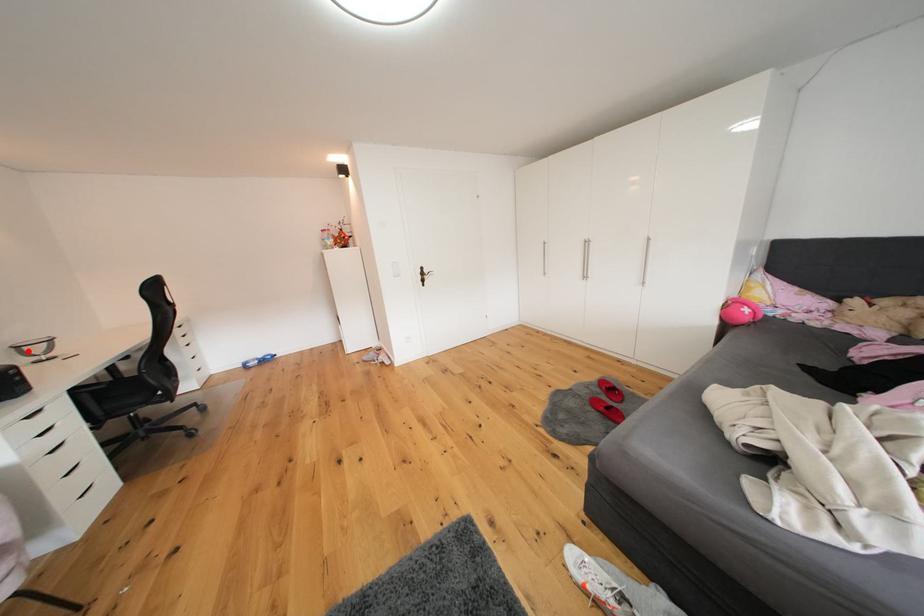
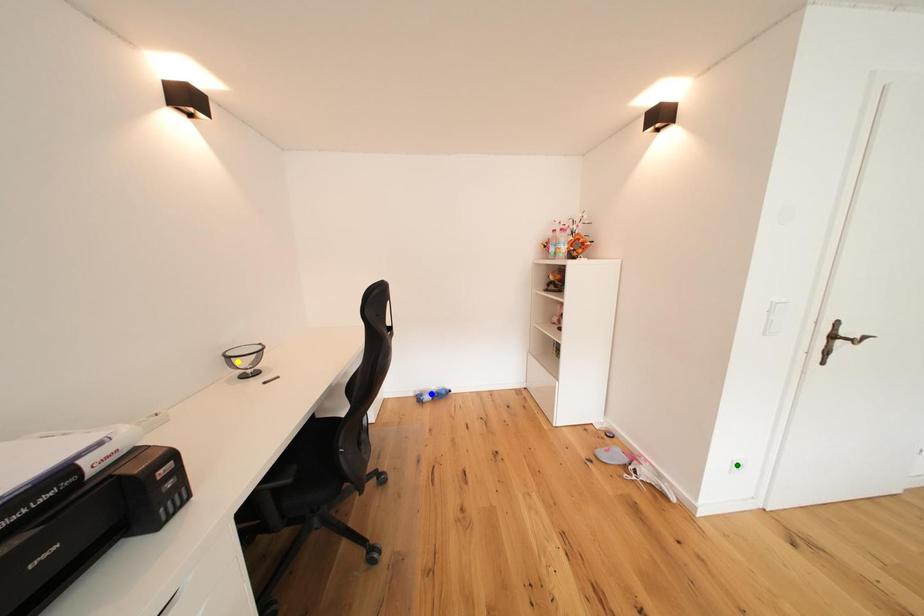
Question: I am providing you with two images of the same scene from different viewpoints. A red point is marked on the first image. You are given multiple points on the second image. In image 2, which mark is for the same physical point as the one in image 1?

Choices:
 (A) green point
 (B) blue point
 (C) yellow point

Answer: (C)